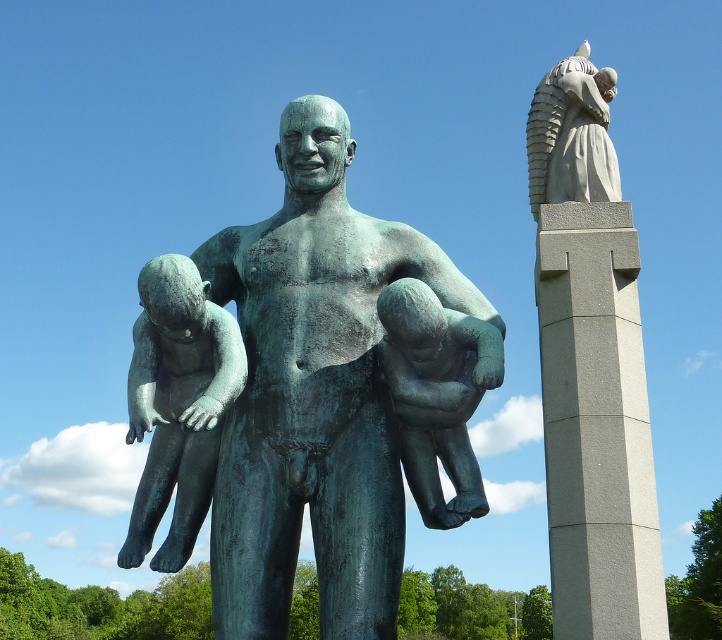
Question: Can you confirm if bronze baby at center is positioned above matte gray statue at upper right?

Choices:
 (A) yes
 (B) no

Answer: (B)

Question: Which object is closer to the camera taking this photo?

Choices:
 (A) polished bronze child at left
 (B) bronze baby at center
 (C) matte gray statue at upper right

Answer: (A)

Question: Considering the real-world distances, which object is farthest from the gray concrete pillar at right?

Choices:
 (A) bronze statue of man holding children at center
 (B) bronze baby at center
 (C) polished bronze child at left

Answer: (C)

Question: Does gray concrete pillar at right have a greater width compared to matte gray statue at upper right?

Choices:
 (A) yes
 (B) no

Answer: (A)

Question: Is bronze statue of man holding children at center thinner than polished bronze child at left?

Choices:
 (A) no
 (B) yes

Answer: (A)

Question: Which point is farther to the camera?

Choices:
 (A) (565, 163)
 (B) (152, 353)

Answer: (A)